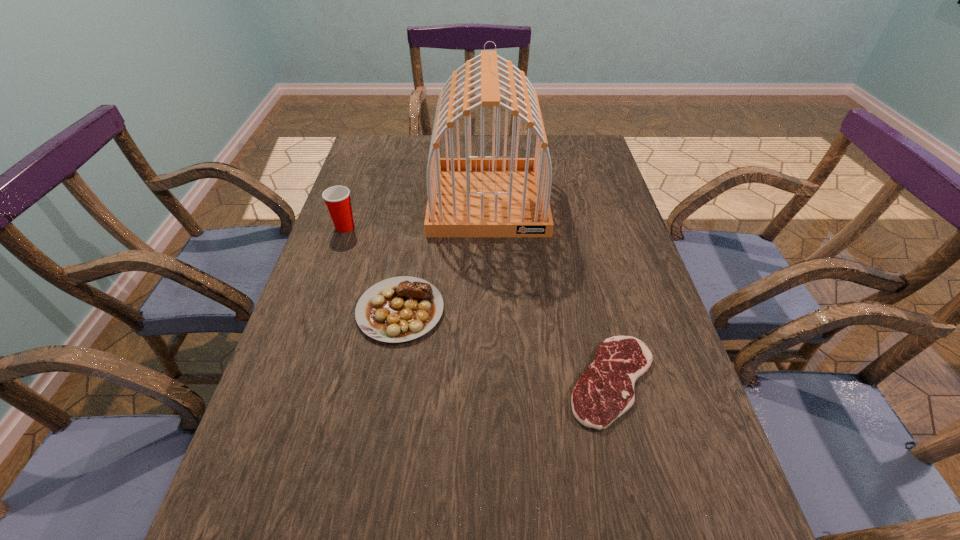
Select which object is the second closest to the second shortest object. Please provide its 2D coordinates. Your answer should be formatted as a tuple, i.e. [(x, y)], where the tuple contains the x and y coordinates of a point satisfying the conditions above.

[(337, 198)]

Where is `object that is the second nearest to the shorter steak`? object that is the second nearest to the shorter steak is located at coordinates (478, 196).

Identify the location of vacant space that satisfies the following two spatial constraints: 1. with an open door on the birdcage; 2. on the left side of the right steak. The width and height of the screenshot is (960, 540). (492, 381).

Where is `free location that satisfies the following two spatial constraints: 1. on the front side of the left steak; 2. on the right side of the shorter steak`? free location that satisfies the following two spatial constraints: 1. on the front side of the left steak; 2. on the right side of the shorter steak is located at coordinates (389, 381).